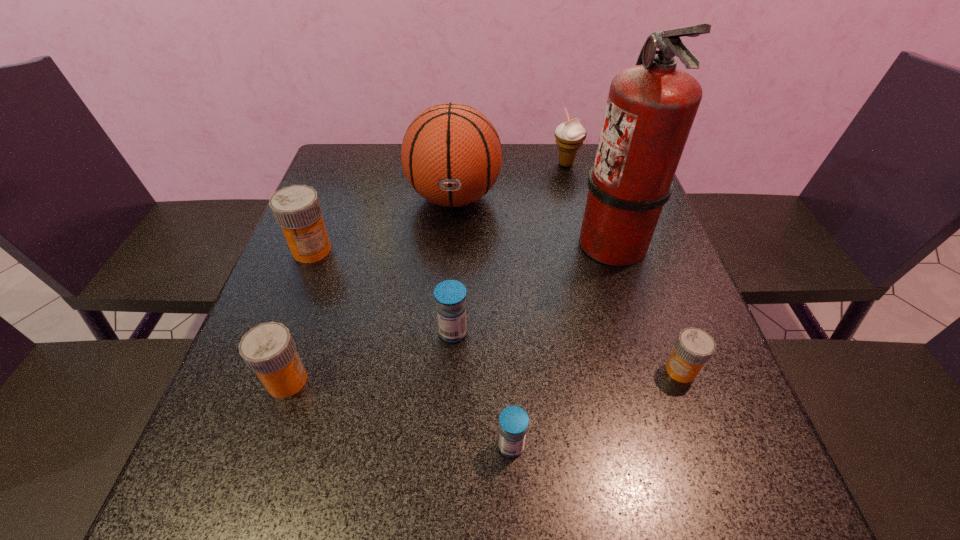
In order to click on the rightmost medicine in this screenshot , I will do tap(694, 347).

The image size is (960, 540). What are the coordinates of `the rightmost orange medicine` in the screenshot? It's located at click(694, 347).

Identify the location of the nearer blue medicine. 514,420.

Where is `the smaller blue medicine`? the smaller blue medicine is located at coordinates (514, 420).

Image resolution: width=960 pixels, height=540 pixels. I want to click on vacant space situated toward the nozzle of the fire extinguisher, so click(x=439, y=242).

Where is `vacant space situated 0.310m toward the nozzle of the fire extinguisher`? vacant space situated 0.310m toward the nozzle of the fire extinguisher is located at coordinates (447, 242).

Locate an element on the screen. vacant space situated 0.090m toward the nozzle of the fire extinguisher is located at coordinates (539, 242).

You are a GUI agent. You are given a task and a screenshot of the screen. Output one action in this format:
    pyautogui.click(x=<x>, y=<y>)
    Task: Click on the vacant space located 0.260m on the side where the inflation valve is located
    This screenshot has width=960, height=540.
    Given the screenshot: What is the action you would take?
    coord(446,308)

Identify the location of vacant area situated 0.390m on the front of the white icecream. The height and width of the screenshot is (540, 960). (591, 267).

Identify the location of vacant point located 0.220m on the label side of the tallest medicine. This screenshot has width=960, height=540. (276, 344).